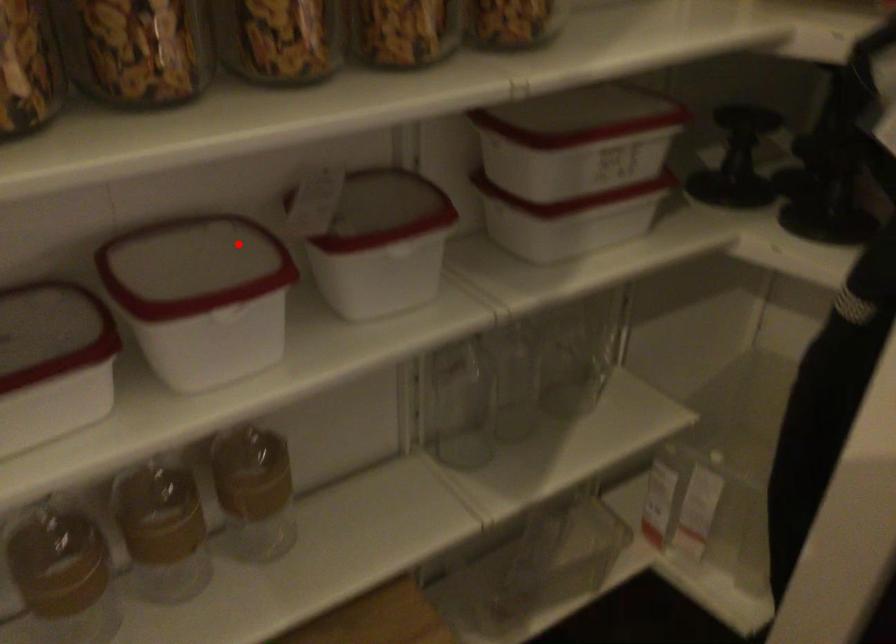
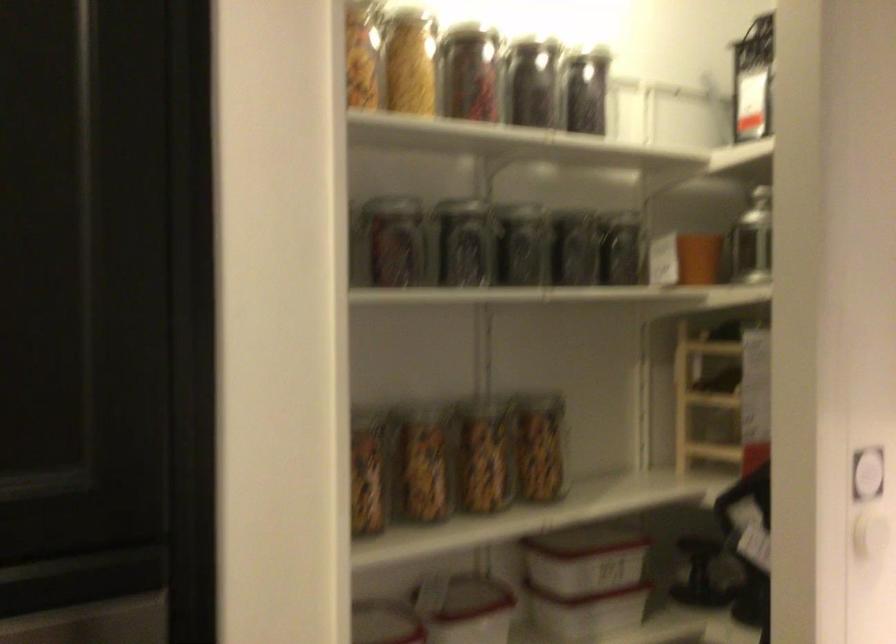
In the second image, find the point that corresponds to the highlighted location in the first image.

(383, 623)